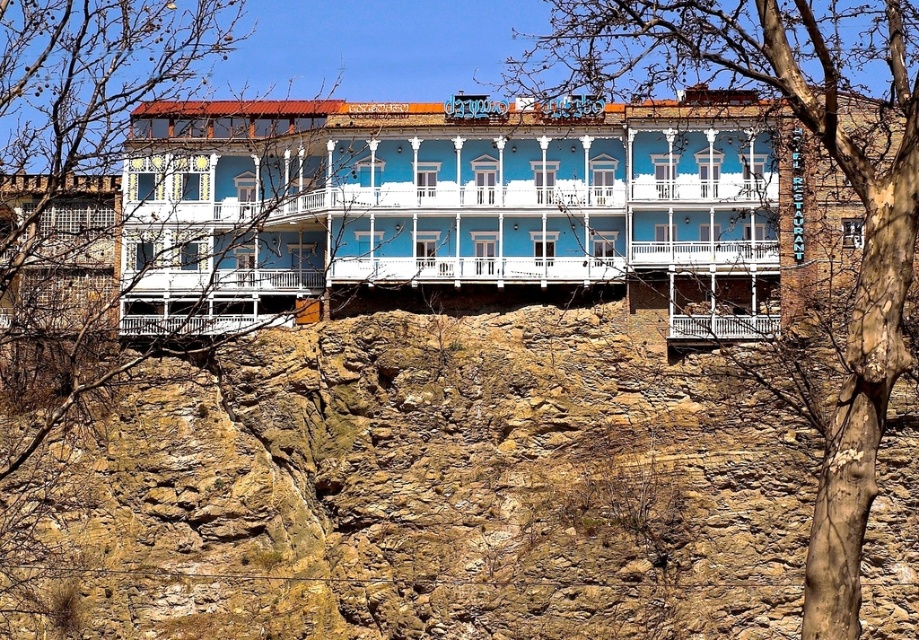
Question: Which point is farther to the camera?

Choices:
 (A) (82, 104)
 (B) (664, 449)
 (C) (651, 38)

Answer: (A)

Question: Can you confirm if brown rocky hillside at center is positioned above bare branches at upper left?

Choices:
 (A) yes
 (B) no

Answer: (B)

Question: From the image, what is the correct spatial relationship of brown rocky hillside at center in relation to bare bark tree at center?

Choices:
 (A) left
 (B) right

Answer: (A)

Question: Which point is farther to the camera?

Choices:
 (A) (65, 387)
 (B) (685, 60)

Answer: (A)

Question: Which point is farther to the camera?

Choices:
 (A) (278, 189)
 (B) (645, 547)
 (C) (683, 42)

Answer: (A)

Question: Is bare branches at upper left further to the viewer compared to bare bark tree at center?

Choices:
 (A) no
 (B) yes

Answer: (B)